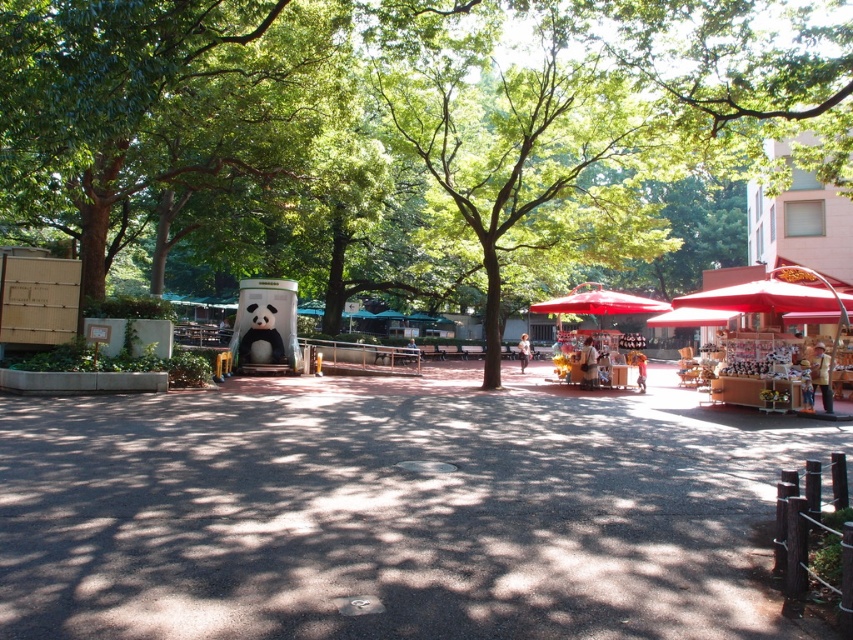
Is green leafy tree at center shorter than yellow fabric vendor at lower right?

In fact, green leafy tree at center may be taller than yellow fabric vendor at lower right.

Between point (123, 204) and point (830, 397), which one is positioned in front?

Point (830, 397)

Where is `green leafy tree at center`? green leafy tree at center is located at coordinates (405, 131).

Does green leafy tree at center appear on the right side of matte red umbrella at center?

No, green leafy tree at center is not to the right of matte red umbrella at center.

Does green leafy tree at center have a smaller size compared to matte red umbrella at center?

No, green leafy tree at center is not smaller than matte red umbrella at center.

This screenshot has height=640, width=853. What do you see at coordinates (405, 131) in the screenshot?
I see `green leafy tree at center` at bounding box center [405, 131].

You are a GUI agent. You are given a task and a screenshot of the screen. Output one action in this format:
    pyautogui.click(x=<x>, y=<y>)
    Task: Click on the green leafy tree at center
    The width and height of the screenshot is (853, 640).
    Given the screenshot: What is the action you would take?
    pyautogui.click(x=405, y=131)

Measure the distance between point [368,16] and camera.

Point [368,16] is 53.48 feet away from camera.

Who is more distant from viewer, (277, 266) or (585, 381)?

Point (277, 266)

Which is in front, point (140, 17) or point (581, 364)?

Point (140, 17) is more forward.

This screenshot has height=640, width=853. Find the location of `green leafy tree at center`. green leafy tree at center is located at coordinates (405, 131).